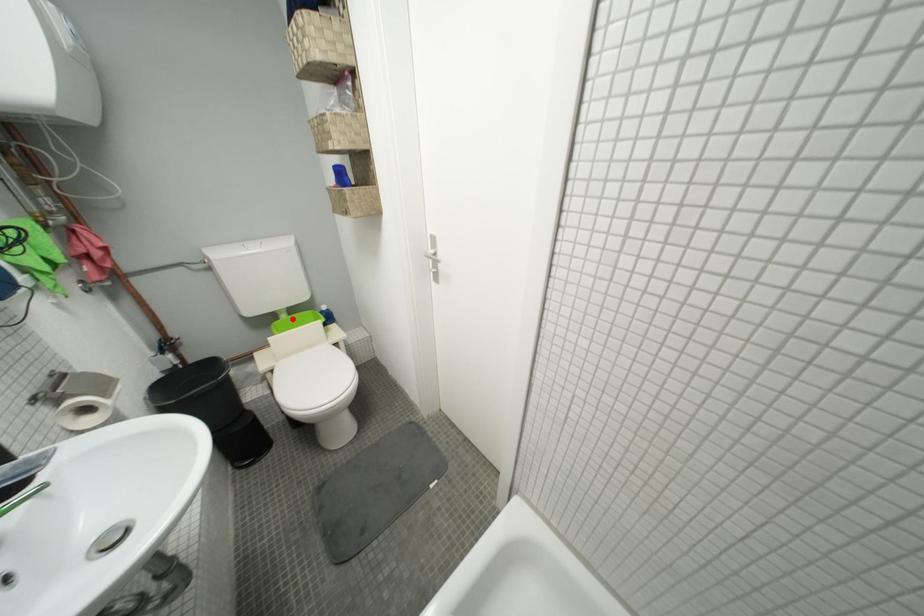
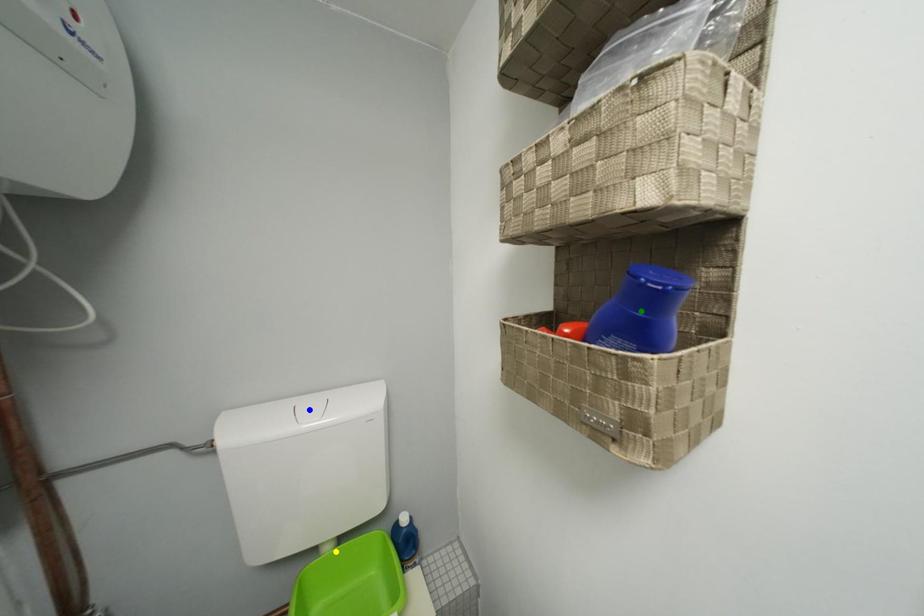
Question: I am providing you with two images of the same scene from different viewpoints. A red point is marked on the first image. You are given multiple points on the second image. Can you choose the point in image 2 that corresponds to the point in image 1?

Choices:
 (A) green point
 (B) yellow point
 (C) blue point

Answer: (B)